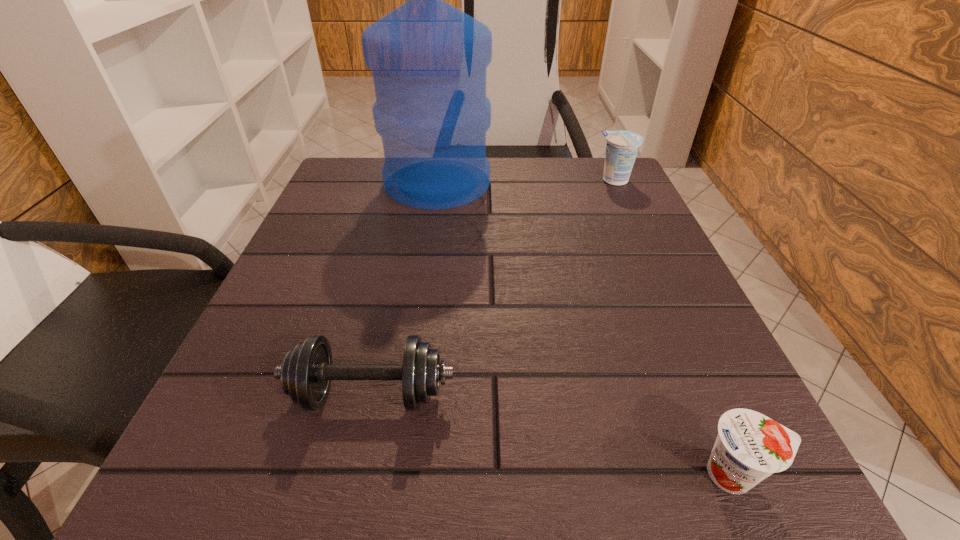
The image size is (960, 540). I want to click on yogurt located at the far edge, so click(622, 147).

You are a GUI agent. You are given a task and a screenshot of the screen. Output one action in this format:
    pyautogui.click(x=<x>, y=<y>)
    Task: Click on the object that is positioned at the near edge
    The image size is (960, 540).
    Given the screenshot: What is the action you would take?
    pyautogui.click(x=749, y=447)

I want to click on water jug that is at the left edge, so click(429, 60).

Where is `dumbbell situated at the left edge`? This screenshot has height=540, width=960. dumbbell situated at the left edge is located at coordinates (307, 371).

The width and height of the screenshot is (960, 540). What are the coordinates of `object that is at the far left corner` in the screenshot? It's located at (429, 60).

Identify the location of object present at the far right corner. (622, 147).

Identify the location of object located at the near right corner. (749, 447).

In the image, there is a desktop. At what (x,y) coordinates should I click in order to perform the action: click on vacant space at the far edge. Please return your answer as a coordinate pair (x, y). The width and height of the screenshot is (960, 540). Looking at the image, I should click on point(516,186).

In the image, there is a desktop. Identify the location of vacant space at the left edge. The image size is (960, 540). (360, 218).

Find the location of a particular element. The height and width of the screenshot is (540, 960). vacant space at the right edge of the desktop is located at coordinates (706, 368).